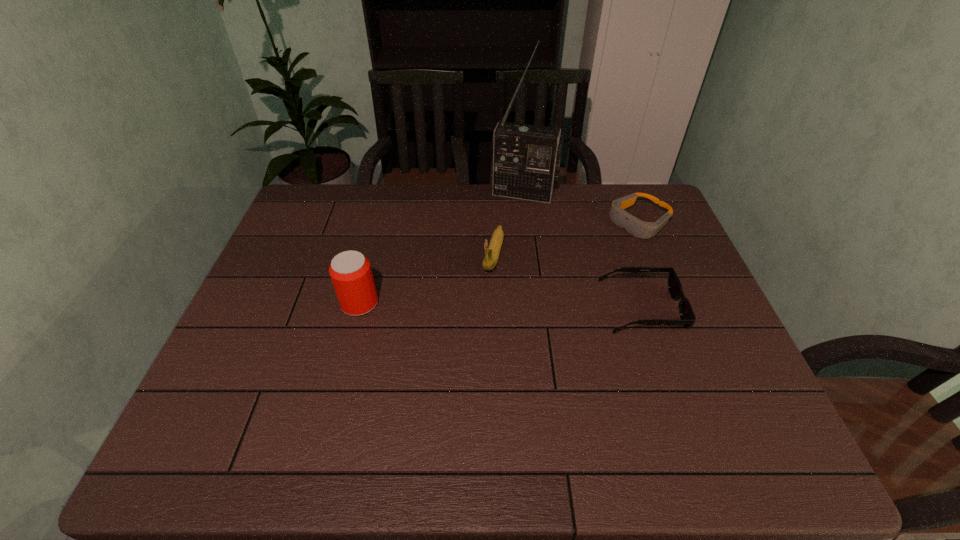
Where is `beer can`? The height and width of the screenshot is (540, 960). beer can is located at coordinates (350, 271).

The width and height of the screenshot is (960, 540). In order to click on the fourth shortest object in this screenshot , I will do `click(350, 271)`.

Image resolution: width=960 pixels, height=540 pixels. What are the coordinates of `sunglasses` in the screenshot? It's located at [687, 316].

At what (x,y) coordinates should I click in order to perform the action: click on the tallest object. Please return your answer as a coordinate pair (x, y). Image resolution: width=960 pixels, height=540 pixels. Looking at the image, I should click on (526, 158).

What are the coordinates of `the farthest object` in the screenshot? It's located at (526, 158).

This screenshot has height=540, width=960. I want to click on the third tallest object, so click(x=492, y=250).

Find the location of a particular element. The image size is (960, 540). goggles is located at coordinates (641, 229).

Locate an element on the screen. The image size is (960, 540). vacant region located 0.050m on the left of the beer can is located at coordinates click(323, 303).

Image resolution: width=960 pixels, height=540 pixels. In order to click on free space located 0.080m at the front lenses of the sunglasses in this screenshot , I will do `click(708, 308)`.

At what (x,y) coordinates should I click in order to perform the action: click on free spot located 0.210m on the display of the farthest object. Please return your answer as a coordinate pair (x, y). Looking at the image, I should click on (504, 243).